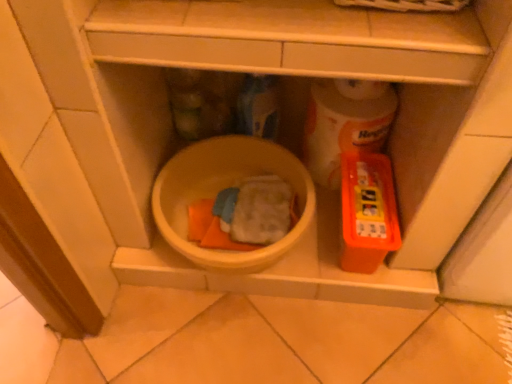
Find the location of a particular element. free space above orange plastic container at right (from a real-world perspective) is located at coordinates (365, 187).